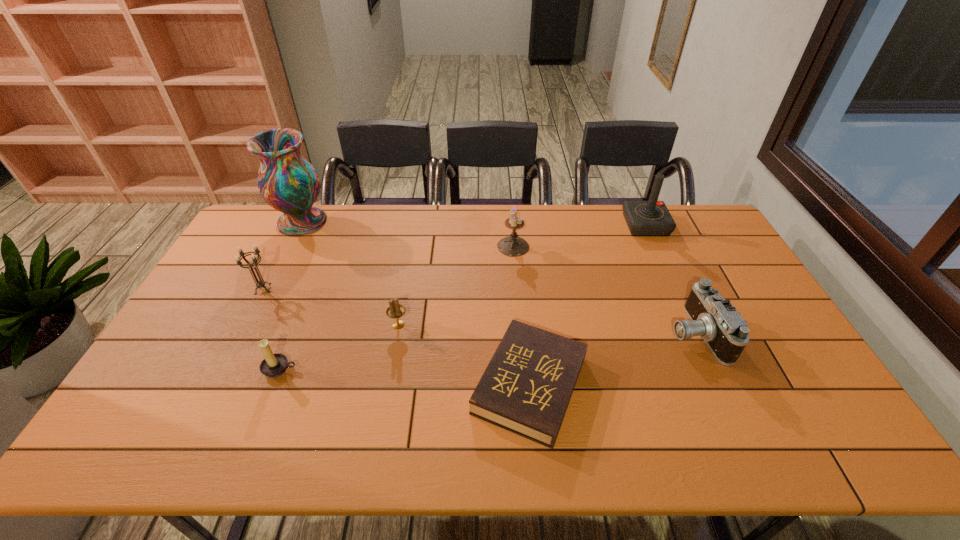
Locate an element on the screen. Image resolution: width=960 pixels, height=540 pixels. blank space located 0.200m on the wick of the nearest candle holder is located at coordinates (246, 456).

The image size is (960, 540). What are the coordinates of `vacant space located 0.340m on the back of the shortest object` in the screenshot? It's located at (517, 256).

Identify the location of vase that is at the far edge. pyautogui.click(x=288, y=183).

Where is `joystick at the far edge`? Image resolution: width=960 pixels, height=540 pixels. joystick at the far edge is located at coordinates pyautogui.click(x=644, y=218).

Where is `candle holder positioned at the far edge`? The height and width of the screenshot is (540, 960). candle holder positioned at the far edge is located at coordinates coord(513,245).

You are a GUI agent. You are given a task and a screenshot of the screen. Output one action in this format:
    pyautogui.click(x=<x>, y=<y>)
    Task: Click on the object positioned at the near edge
    
    Given the screenshot: What is the action you would take?
    pyautogui.click(x=526, y=388)

Locate an element on the screen. vase located in the left edge section of the desktop is located at coordinates (288, 183).

Locate an element on the screen. The height and width of the screenshot is (540, 960). candle holder that is positioned at the left edge is located at coordinates (261, 283).

Locate an element on the screen. The height and width of the screenshot is (540, 960). object that is positioned at the far left corner is located at coordinates (288, 183).

This screenshot has width=960, height=540. What are the coordinates of `free region at the far edge` in the screenshot? It's located at (612, 224).